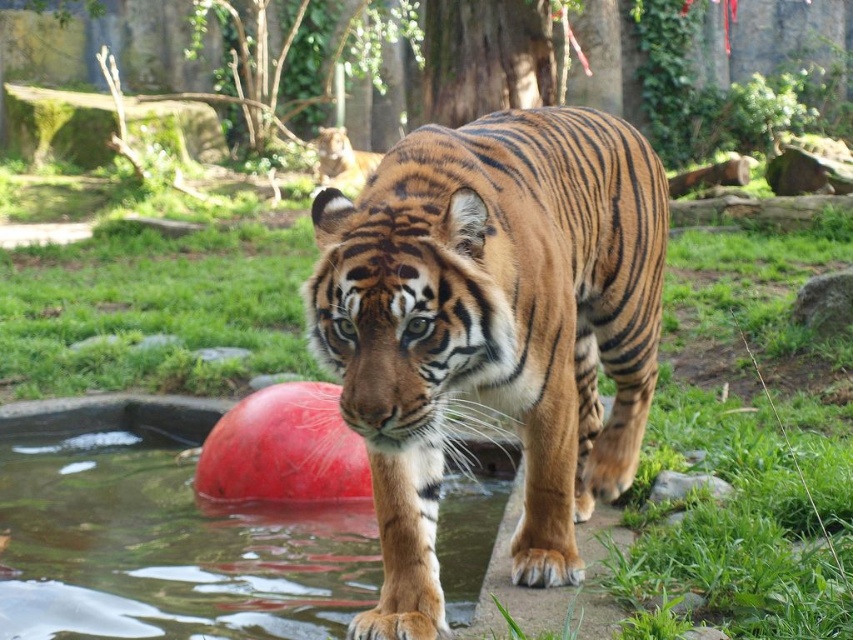
Question: Is orange-brown striped tiger at center further to camera compared to glossy plastic water at lower center?

Choices:
 (A) no
 (B) yes

Answer: (A)

Question: Among these points, which one is farthest from the camera?

Choices:
 (A) (422, 141)
 (B) (74, 506)

Answer: (B)

Question: Is orange-brown striped tiger at center closer to the viewer compared to glossy plastic water at lower center?

Choices:
 (A) yes
 (B) no

Answer: (A)

Question: Which of the following is the closest to the observer?

Choices:
 (A) (370, 588)
 (B) (648, 250)

Answer: (B)

Question: Which object appears closest to the camera in this image?

Choices:
 (A) orange-brown striped tiger at center
 (B) glossy plastic water at lower center

Answer: (A)

Question: Does orange-brown striped tiger at center appear over glossy plastic water at lower center?

Choices:
 (A) no
 (B) yes

Answer: (B)